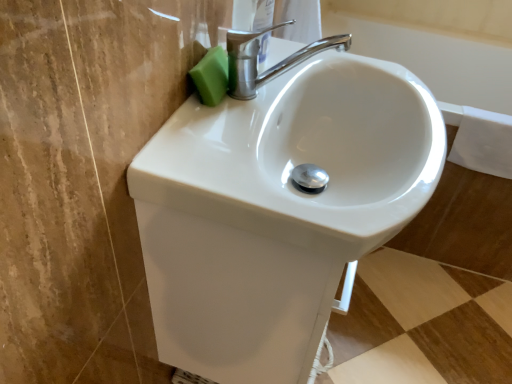
Question: From a real-world perspective, is green sponge at upper left physically located above or below white glossy sink at center?

Choices:
 (A) above
 (B) below

Answer: (A)

Question: Is green sponge at upper left bigger or smaller than white glossy sink at center?

Choices:
 (A) big
 (B) small

Answer: (B)

Question: Which object is positioned closest to the polished chrome faucet at upper center?

Choices:
 (A) green sponge at upper left
 (B) white glossy sink at center

Answer: (A)

Question: Which object is positioned closest to the white glossy sink at center?

Choices:
 (A) polished chrome faucet at upper center
 (B) green sponge at upper left

Answer: (A)